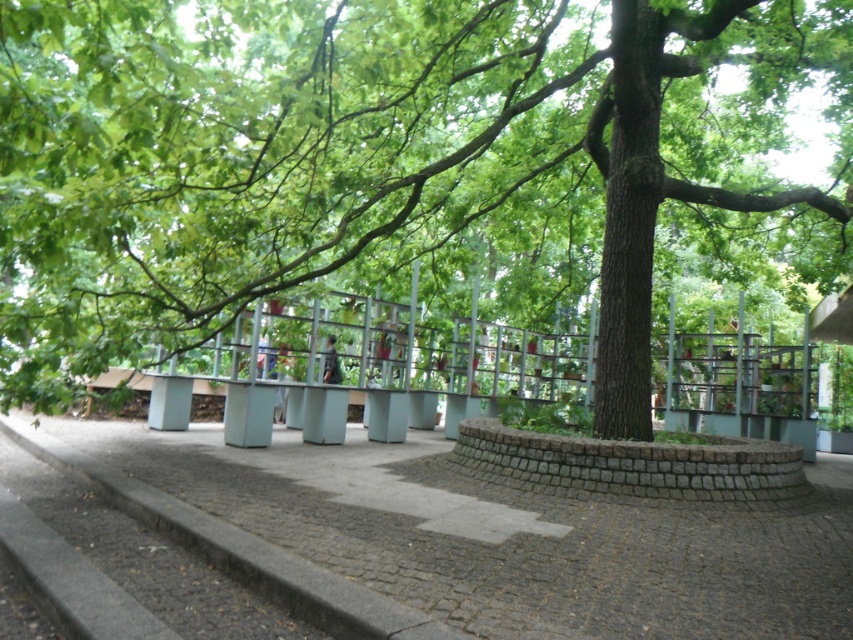
Which is behind, point (39, 353) or point (500, 593)?

The point (39, 353) is behind.

Who is positioned more to the left, green leafy tree at center or gray cobblestone pavement at center?

gray cobblestone pavement at center is more to the left.

Which is behind, point (392, 58) or point (486, 500)?

Point (486, 500)

Where is `green leafy tree at center`? Image resolution: width=853 pixels, height=640 pixels. green leafy tree at center is located at coordinates (340, 154).